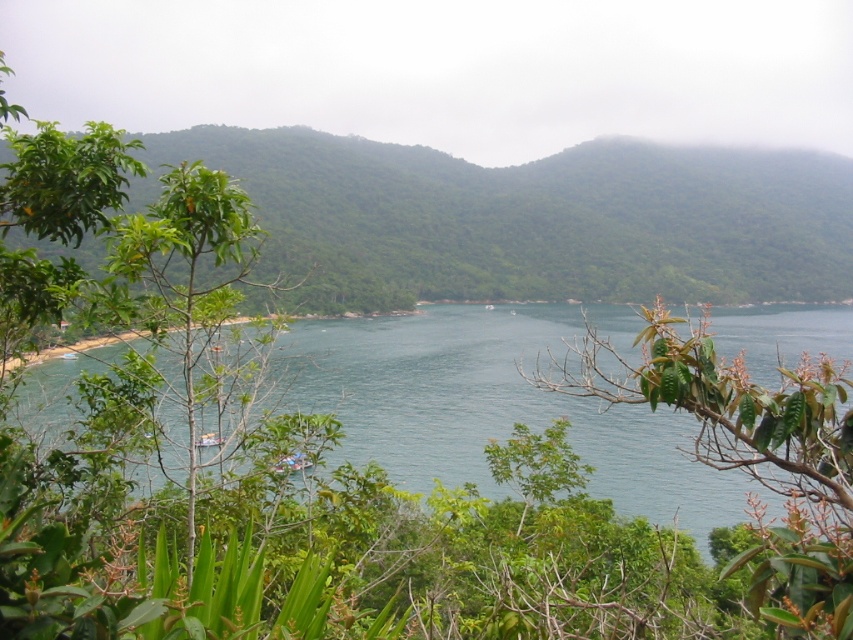
Question: Does green leafy forest at center appear under green leafy branch at center?

Choices:
 (A) yes
 (B) no

Answer: (B)

Question: Which point is farther to the camera?

Choices:
 (A) (613, 200)
 (B) (761, 582)

Answer: (A)

Question: Is clear blue water at center bigger than green leafy branch at center?

Choices:
 (A) yes
 (B) no

Answer: (A)

Question: Can you confirm if green leafy forest at center is positioned to the left of green leafy branch at center?

Choices:
 (A) yes
 (B) no

Answer: (B)

Question: Which of the following is the closest to the observer?

Choices:
 (A) green leafy forest at center
 (B) clear blue water at center

Answer: (B)

Question: Which point is closer to the camera taking this photo?

Choices:
 (A) (686, 490)
 (B) (744, 227)
 (C) (578, 392)

Answer: (C)